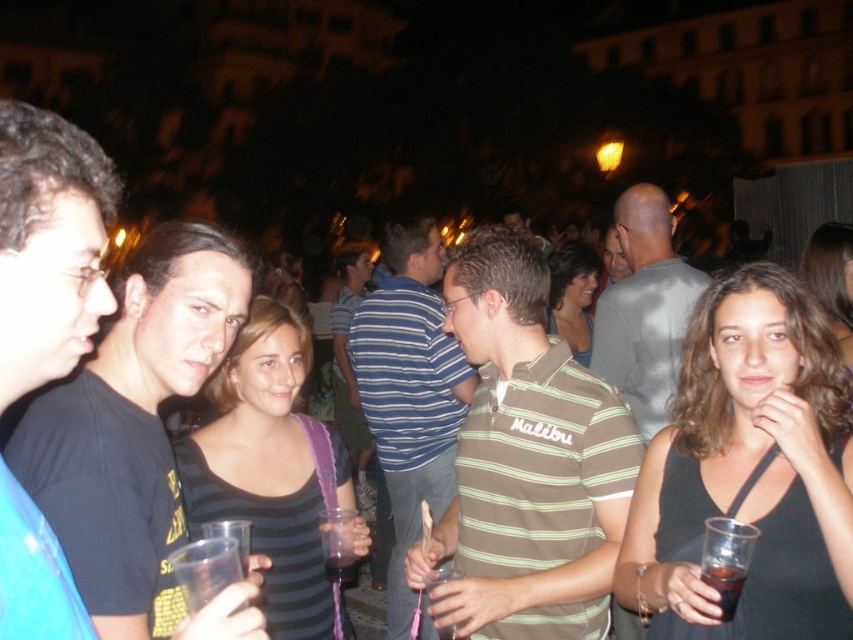
Looking at this image, is green striped polo shirt at center to the right of translucent plastic cup at center from the viewer's perspective?

Correct, you'll find green striped polo shirt at center to the right of translucent plastic cup at center.

Does green striped polo shirt at center have a greater width compared to translucent plastic cup at center?

Correct, the width of green striped polo shirt at center exceeds that of translucent plastic cup at center.

Which is behind, point (496, 397) or point (338, 572)?

Positioned behind is point (496, 397).

You are a GUI agent. You are given a task and a screenshot of the screen. Output one action in this format:
    pyautogui.click(x=<x>, y=<y>)
    Task: Click on the green striped polo shirt at center
    This screenshot has width=853, height=640.
    Given the screenshot: What is the action you would take?
    pyautogui.click(x=527, y=460)

Is black matte shirt at left below dark brown liquid at lower right?

Incorrect, black matte shirt at left is not positioned below dark brown liquid at lower right.

Is black matte shirt at left to the left of dark brown liquid at lower right from the viewer's perspective?

Yes, black matte shirt at left is to the left of dark brown liquid at lower right.

You are a GUI agent. You are given a task and a screenshot of the screen. Output one action in this format:
    pyautogui.click(x=<x>, y=<y>)
    Task: Click on the black matte shirt at left
    The height and width of the screenshot is (640, 853).
    Given the screenshot: What is the action you would take?
    pyautogui.click(x=49, y=244)

Who is lower down, gray cotton shirt at center or dark brown liquid at lower right?

Positioned lower is dark brown liquid at lower right.

Locate an element on the screen. This screenshot has height=640, width=853. gray cotton shirt at center is located at coordinates (643, 308).

Between point (640, 264) and point (729, 602), which one is positioned in front?

Point (729, 602)

Locate an element on the screen. The width and height of the screenshot is (853, 640). gray cotton shirt at center is located at coordinates (643, 308).